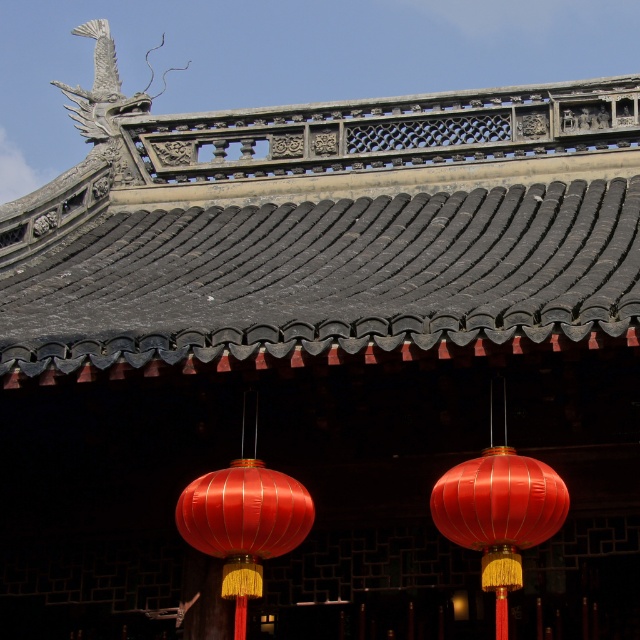
Is shiny red silk lantern at center to the right of satin red lantern at center from the viewer's perspective?

Yes, shiny red silk lantern at center is to the right of satin red lantern at center.

Identify the location of shiny red silk lantern at center. This screenshot has height=640, width=640. (499, 515).

Which is behind, point (499, 598) or point (224, 468)?

The point (224, 468) is more distant.

The width and height of the screenshot is (640, 640). I want to click on shiny red silk lantern at center, so click(499, 515).

Does dark gray textured tiles at upper center lie behind satin red lantern at center?

That is False.

Is dark gray textured tiles at upper center closer to the viewer compared to satin red lantern at center?

Yes, dark gray textured tiles at upper center is in front of satin red lantern at center.

You are a GUI agent. You are given a task and a screenshot of the screen. Output one action in this format:
    pyautogui.click(x=<x>, y=<y>)
    Task: Click on the dark gray textured tiles at upper center
    The height and width of the screenshot is (640, 640).
    Given the screenshot: What is the action you would take?
    pyautogui.click(x=324, y=225)

Can you confirm if dark gray textured tiles at upper center is smaller than shiny red silk lantern at center?

No.

Does point (416, 147) come in front of point (467, 531)?

No, it is not.

What do you see at coordinates (324, 225) in the screenshot? I see `dark gray textured tiles at upper center` at bounding box center [324, 225].

At what (x,y) coordinates should I click in order to perform the action: click on dark gray textured tiles at upper center. Please return your answer as a coordinate pair (x, y). Looking at the image, I should click on (324, 225).